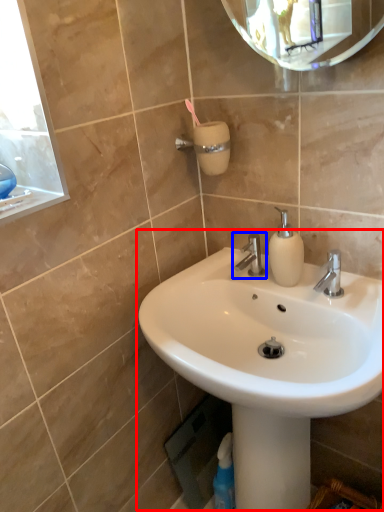
Question: Which object appears farthest to the camera in this image, sink (highlighted by a red box) or tap (highlighted by a blue box)?

Choices:
 (A) sink
 (B) tap

Answer: (B)